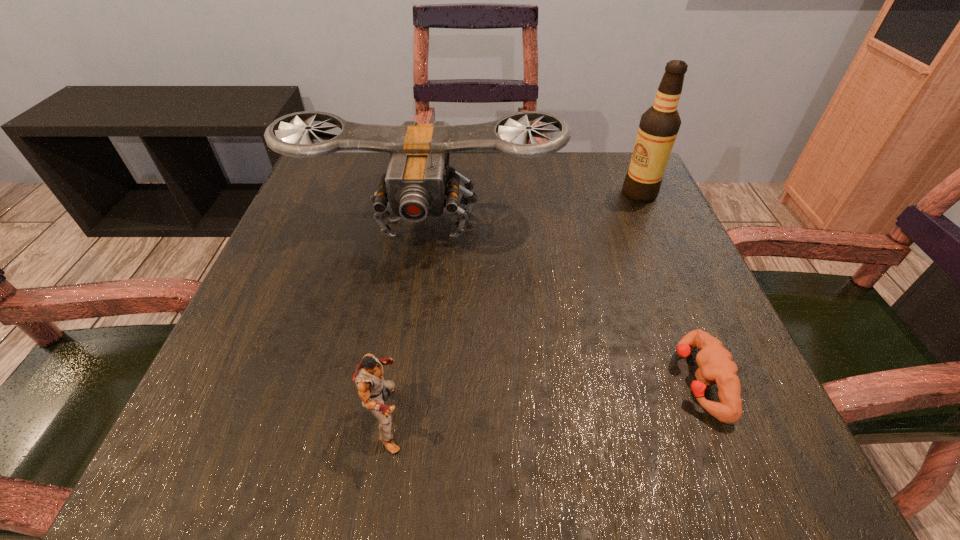
Where is `vacant space that's between the second tallest object and the left puncher`? The width and height of the screenshot is (960, 540). vacant space that's between the second tallest object and the left puncher is located at coordinates (407, 320).

Where is `vacant space that is in between the shorter puncher and the drone`? vacant space that is in between the shorter puncher and the drone is located at coordinates (563, 301).

Identify the location of blank region between the third tallest object and the right puncher. (543, 399).

The height and width of the screenshot is (540, 960). In order to click on free spot between the third shortest object and the taller puncher in this screenshot , I will do `click(407, 320)`.

The image size is (960, 540). Identify the location of blank region between the taller puncher and the alcohol. (514, 306).

The image size is (960, 540). Identify the location of free space between the shorter puncher and the second tallest object. [x=563, y=301].

The image size is (960, 540). What are the coordinates of `empty space between the drone and the alcohol` in the screenshot? It's located at point(533,207).

Locate an element on the screen. The width and height of the screenshot is (960, 540). free space between the right puncher and the second shortest object is located at coordinates pyautogui.click(x=543, y=399).

Locate an element on the screen. vacant area that lies between the right puncher and the taller puncher is located at coordinates (543, 399).

This screenshot has height=540, width=960. I want to click on object that is the closest to the right puncher, so click(419, 183).